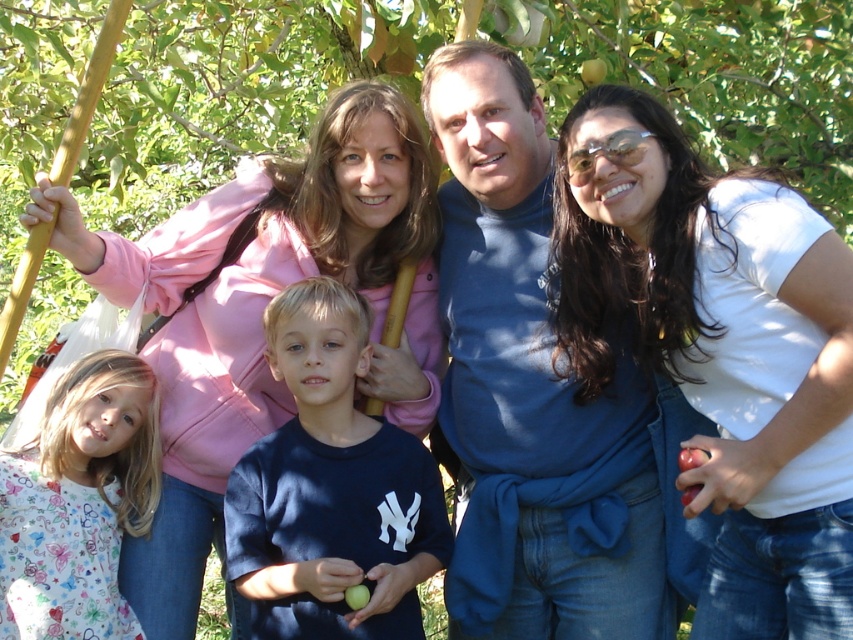
Question: Considering the real-world distances, which object is closest to the pink fleece jacket at upper left?

Choices:
 (A) white matte shirt at upper right
 (B) printed cotton shirt at lower left
 (C) green leafy tree at center

Answer: (B)

Question: Which object is positioned farthest from the dark blue cotton shirt at center?

Choices:
 (A) green leafy tree at center
 (B) white matte shirt at upper right
 (C) blue cotton shirt at center
 (D) printed cotton shirt at lower left

Answer: (A)

Question: Can you confirm if green leafy tree at center is smaller than printed cotton shirt at lower left?

Choices:
 (A) yes
 (B) no

Answer: (B)

Question: Can you confirm if white matte shirt at upper right is positioned to the right of printed cotton shirt at lower left?

Choices:
 (A) yes
 (B) no

Answer: (A)

Question: Which point is closer to the camera?

Choices:
 (A) white matte shirt at upper right
 (B) printed cotton shirt at lower left
 (C) blue cotton shirt at center
 (D) dark blue cotton shirt at center

Answer: (A)

Question: Is white matte shirt at upper right above blue cotton shirt at center?

Choices:
 (A) no
 (B) yes

Answer: (A)